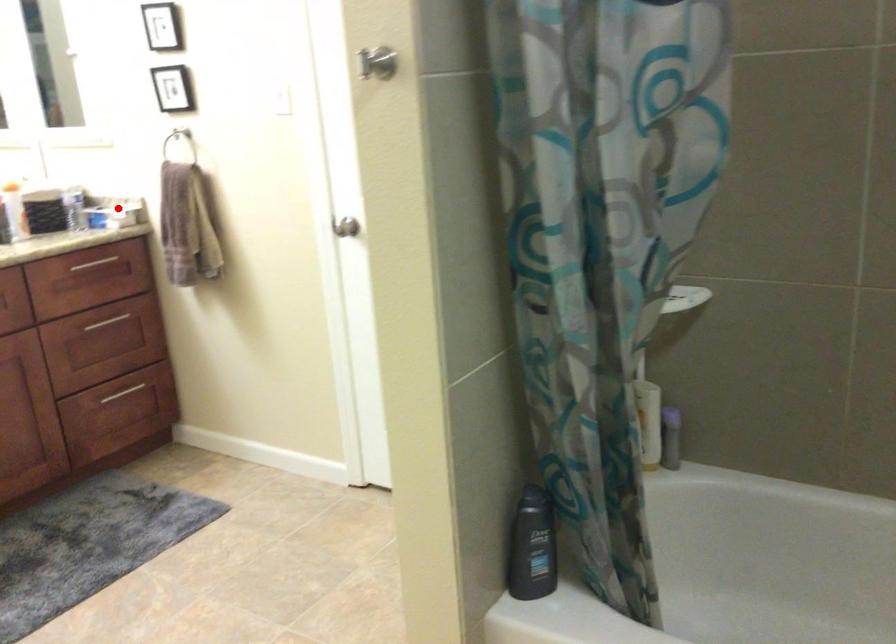
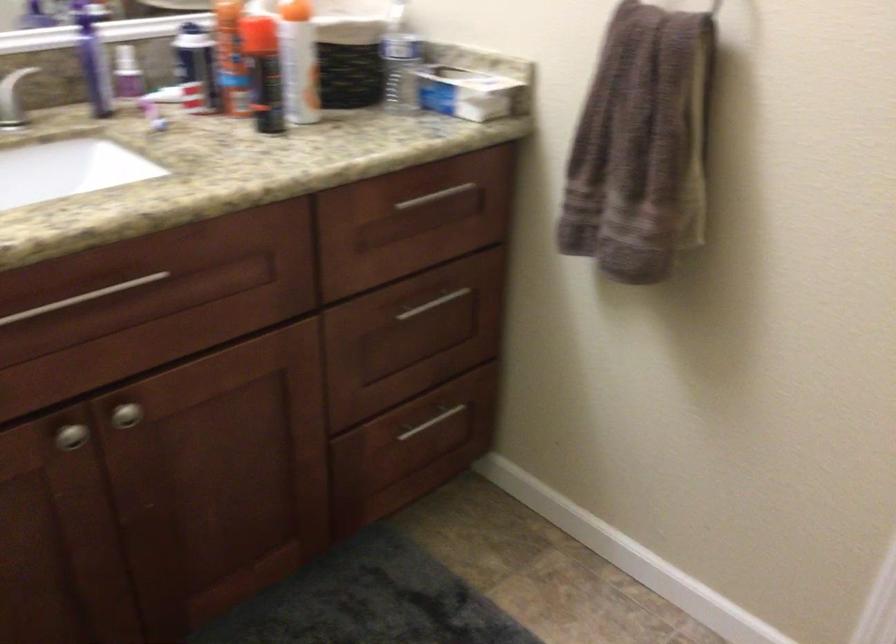
Question: I am providing you with two images of the same scene from different viewpoints. Image1 has a red point marked. In image2, the corresponding 3D location appears at what relative position? Reply with the corresponding letter.

Choices:
 (A) Closer
 (B) Farther

Answer: (A)